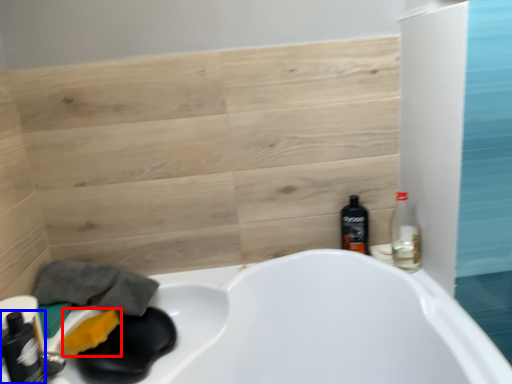
Question: Which of the following is the closest to the observer, soap (highlighted by a red box) or bottle (highlighted by a blue box)?

Choices:
 (A) soap
 (B) bottle

Answer: (B)